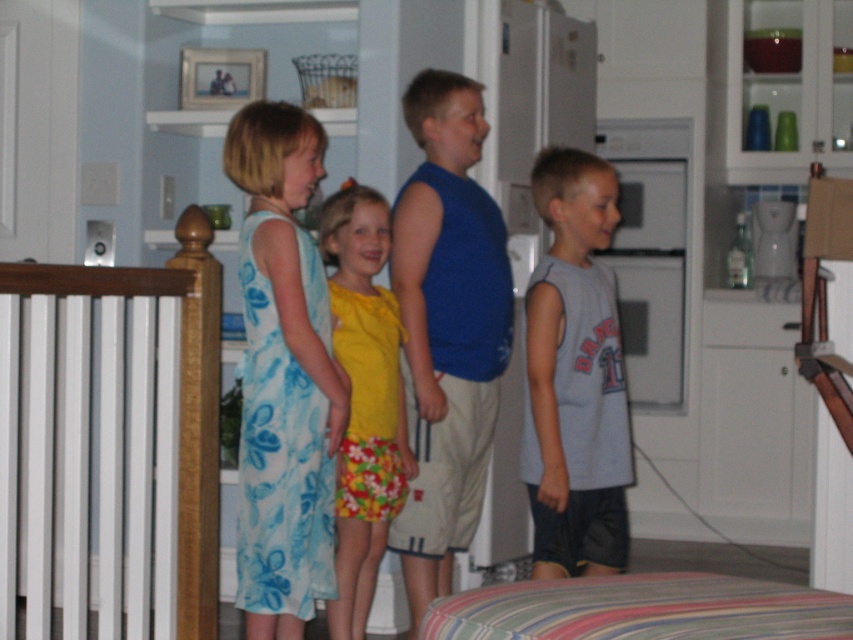
Question: Does blue floral dress at left come in front of yellow fabric dress at center?

Choices:
 (A) no
 (B) yes

Answer: (A)

Question: Which of these objects is positioned farthest from the white wooden balustrade at left?

Choices:
 (A) yellow fabric dress at center
 (B) gray cotton shirt at center

Answer: (B)

Question: Is blue cotton shirt at center to the right of yellow fabric dress at center from the viewer's perspective?

Choices:
 (A) no
 (B) yes

Answer: (B)

Question: Is white wooden balustrade at left above gray cotton shirt at center?

Choices:
 (A) no
 (B) yes

Answer: (A)

Question: Which object is closer to the camera taking this photo?

Choices:
 (A) gray cotton shirt at center
 (B) blue floral dress at left
 (C) white wooden balustrade at left

Answer: (A)

Question: Which point is farther to the camera?

Choices:
 (A) (543, 513)
 (B) (431, 588)
 (C) (456, 173)
 (D) (143, 365)

Answer: (C)